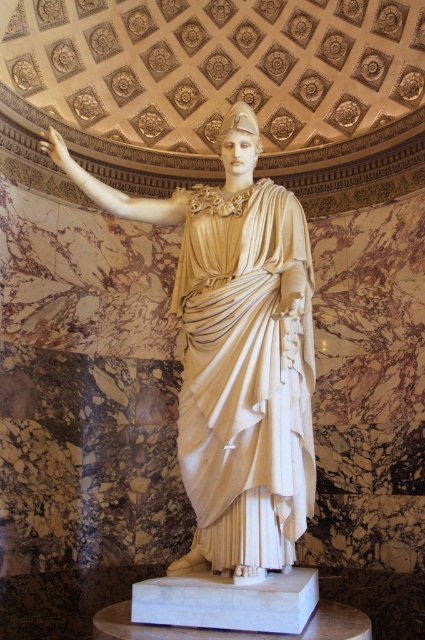
Question: Which point is closer to the camera?

Choices:
 (A) (254, 214)
 (B) (235, 548)

Answer: (B)

Question: Which point is farther to the camera?

Choices:
 (A) (285, 340)
 (B) (295, 205)

Answer: (B)

Question: Is white marble statue at center positioned before white marble robe at center?

Choices:
 (A) no
 (B) yes

Answer: (B)

Question: Does white marble statue at center come in front of white marble robe at center?

Choices:
 (A) no
 (B) yes

Answer: (B)

Question: Which object is farther from the camera taking this photo?

Choices:
 (A) white marble statue at center
 (B) white marble robe at center

Answer: (B)

Question: Does white marble statue at center appear on the left side of white marble robe at center?

Choices:
 (A) no
 (B) yes

Answer: (B)